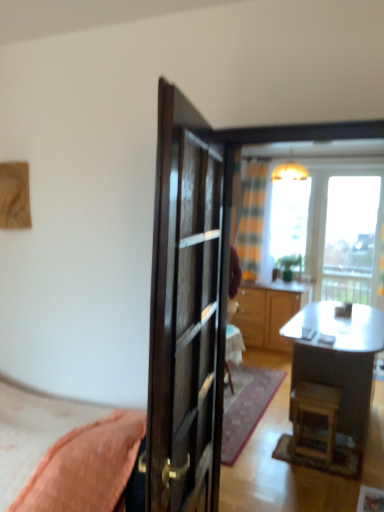
Question: In the image, is wooden cabinet at center positioned in front of or behind glossy dark wood door at center?

Choices:
 (A) behind
 (B) front

Answer: (A)

Question: In terms of width, does wooden cabinet at center look wider or thinner when compared to glossy dark wood door at center?

Choices:
 (A) thin
 (B) wide

Answer: (B)

Question: Considering the real-world distances, which object is farthest from the transparent glass window at upper right?

Choices:
 (A) wooden terrace at center
 (B) matte yellow lampshade at upper center
 (C) glossy dark wood door at center
 (D) wooden cabinet at center
 (E) wooden stool at lower right

Answer: (C)

Question: Which object is the farthest from the transparent glass window at upper center?

Choices:
 (A) wooden stool at lower right
 (B) transparent glass window at upper right
 (C) green matte houseplant at center
 (D) wooden terrace at center
 (E) matte yellow lampshade at upper center

Answer: (A)